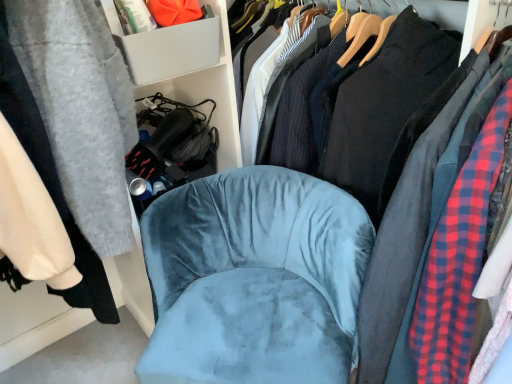
Question: From the image's perspective, is velvet blue chair at center located above or below gray plastic storage bin at upper left?

Choices:
 (A) below
 (B) above

Answer: (A)

Question: Would you say velvet blue chair at center is to the left or to the right of gray plastic storage bin at upper left in the picture?

Choices:
 (A) right
 (B) left

Answer: (A)

Question: Which of these objects is positioned closest to the velvet blue chair at center?

Choices:
 (A) black cotton shirt at center
 (B) gray plastic storage bin at upper left

Answer: (A)

Question: Which object is positioned farthest from the gray plastic storage bin at upper left?

Choices:
 (A) velvet blue chair at center
 (B) black cotton shirt at center

Answer: (B)